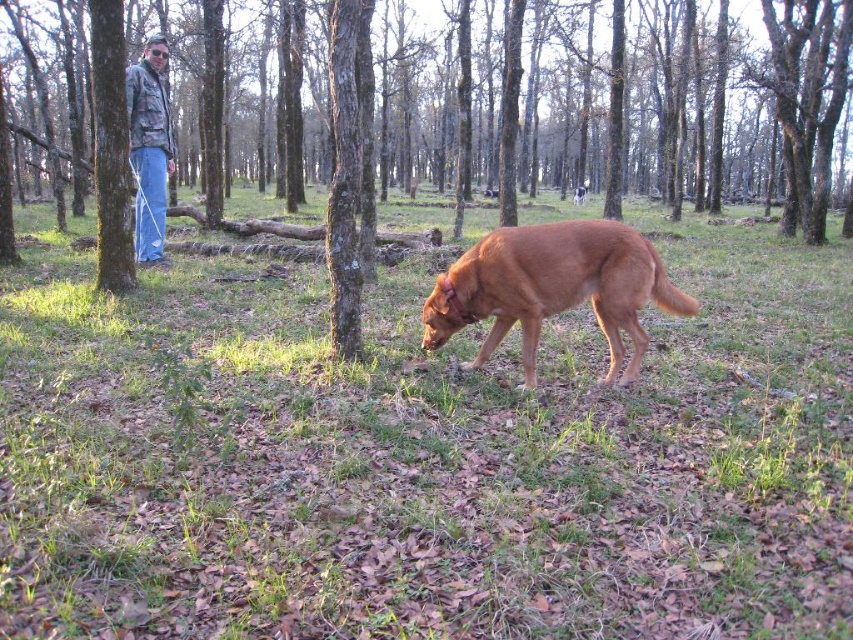
From the picture: Does green grass at center have a greater height compared to brown matte dog at center?

No.

Based on the photo, who is more forward, (x=283, y=486) or (x=527, y=260)?

Point (x=283, y=486) is in front.

What do you see at coordinates (424, 458) in the screenshot?
I see `green grass at center` at bounding box center [424, 458].

This screenshot has height=640, width=853. What are the coordinates of `green grass at center` in the screenshot? It's located at (424, 458).

The height and width of the screenshot is (640, 853). Describe the element at coordinates (553, 288) in the screenshot. I see `brown matte dog at center` at that location.

Who is more distant from viewer, (590, 237) or (129, 108)?

Positioned behind is point (129, 108).

Who is more forward, (x=585, y=227) or (x=144, y=170)?

Point (x=585, y=227) is more forward.

You are a GUI agent. You are given a task and a screenshot of the screen. Output one action in this format:
    pyautogui.click(x=<x>, y=<y>)
    Task: Click on the brown matte dog at center
    
    Given the screenshot: What is the action you would take?
    click(x=553, y=288)

Is green grass at center in front of denim jacket at left?

That is True.

Who is lower down, green grass at center or denim jacket at left?

green grass at center is below.

Does point (395, 592) lie behind point (142, 192)?

No.

Where is `green grass at center`? The height and width of the screenshot is (640, 853). green grass at center is located at coordinates (424, 458).